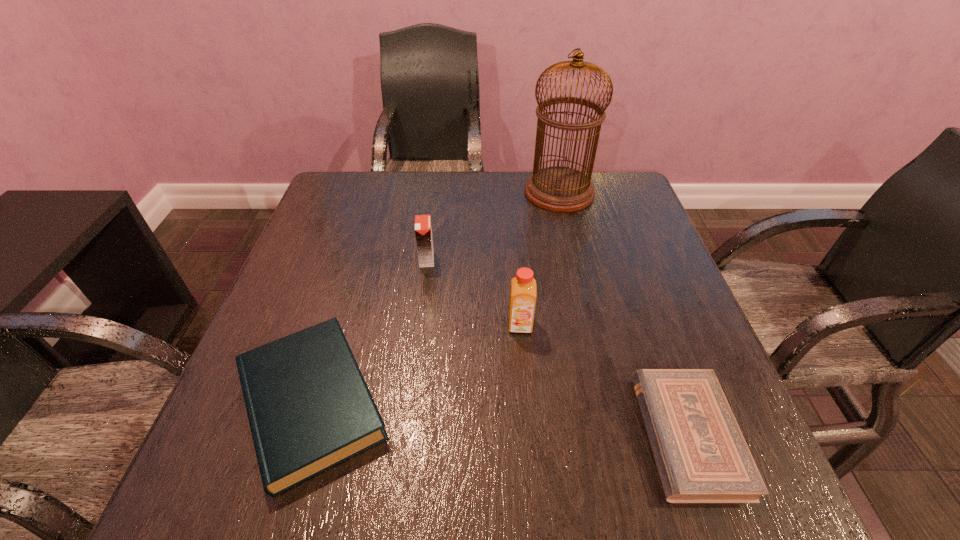
This screenshot has width=960, height=540. I want to click on free spot at the right edge of the desktop, so click(694, 356).

Locate an element on the screen. This screenshot has width=960, height=540. vacant space at the far left corner is located at coordinates (369, 193).

Find the location of a particular element. The width and height of the screenshot is (960, 540). free region at the far right corner of the desktop is located at coordinates (619, 184).

Where is `free space between the birdcage and the left orange juice`? The height and width of the screenshot is (540, 960). free space between the birdcage and the left orange juice is located at coordinates (492, 226).

Where is `vacant area that lies between the second tallest object and the birdcage`? The image size is (960, 540). vacant area that lies between the second tallest object and the birdcage is located at coordinates (540, 259).

Where is `vacant area between the shorter orange juice and the farthest object`? vacant area between the shorter orange juice and the farthest object is located at coordinates (492, 226).

Locate an element on the screen. The image size is (960, 540). empty space between the birdcage and the third object from right to left is located at coordinates (540, 259).

The height and width of the screenshot is (540, 960). I want to click on free spot between the left orange juice and the third object from right to left, so click(473, 292).

The height and width of the screenshot is (540, 960). I want to click on empty space between the farther orange juice and the shortest object, so click(557, 347).

The height and width of the screenshot is (540, 960). Identify the location of free space between the shortest object and the farthest object. (623, 314).